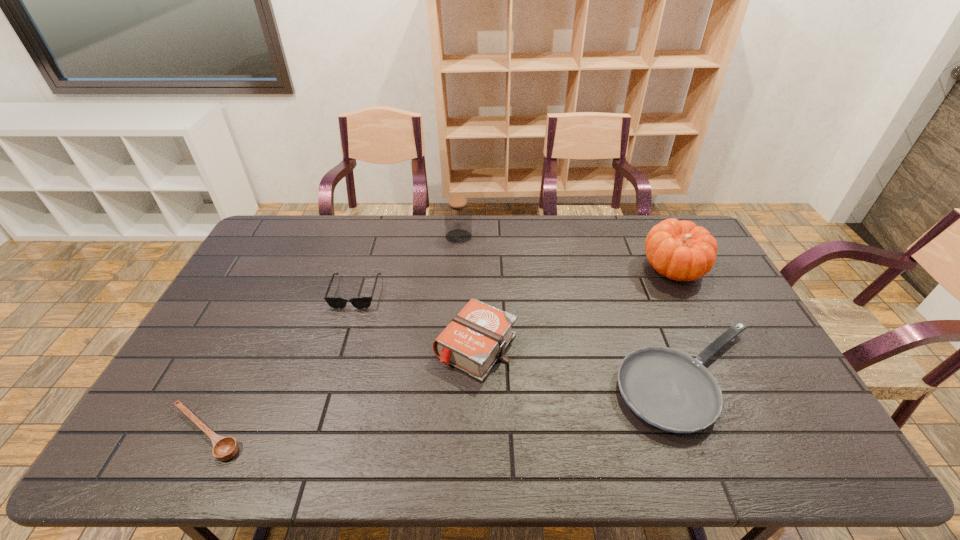
The height and width of the screenshot is (540, 960). I want to click on vacant position in the image that satisfies the following two spatial constraints: 1. at the front lenses of the sunglasses; 2. on the right side of the Bible, so click(x=339, y=347).

This screenshot has width=960, height=540. Find the location of `vacant space that satisfies the following two spatial constraints: 1. on the front side of the fifth tallest object; 2. on the right side of the jar`. vacant space that satisfies the following two spatial constraints: 1. on the front side of the fifth tallest object; 2. on the right side of the jar is located at coordinates (450, 378).

This screenshot has height=540, width=960. What are the coordinates of `vacant area that satisfies the following two spatial constraints: 1. on the back side of the pumpkin; 2. on the right side of the Bible` in the screenshot? It's located at (477, 268).